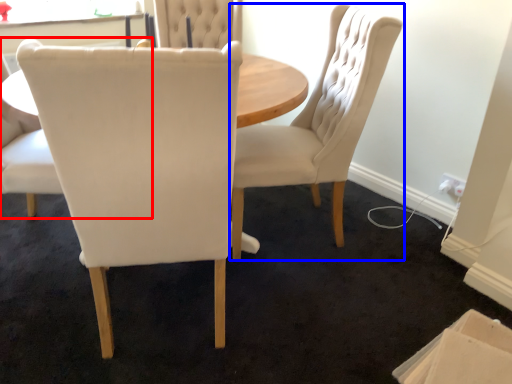
Question: Which of the following is the farthest to the observer, chair (highlighted by a red box) or chair (highlighted by a blue box)?

Choices:
 (A) chair
 (B) chair

Answer: (B)